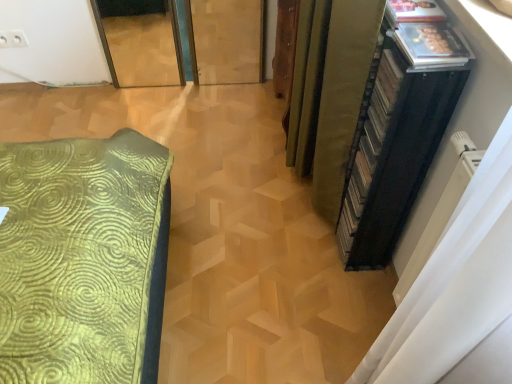
Image resolution: width=512 pixels, height=384 pixels. Describe the element at coordinates (399, 132) in the screenshot. I see `black plastic file cabinet at right` at that location.

In order to click on black plastic file cabinet at right in this screenshot , I will do `click(399, 132)`.

Describe the element at coordinates (13, 39) in the screenshot. This screenshot has width=512, height=384. I see `white plastic electric outlet at upper left` at that location.

The image size is (512, 384). Find the location of `black plastic file cabinet at right`. black plastic file cabinet at right is located at coordinates (399, 132).

In the scene shown: Considering the relative sizes of white plastic electric outlet at upper left and black plastic file cabinet at right in the image provided, is white plastic electric outlet at upper left thinner than black plastic file cabinet at right?

Yes.

Looking at this image, does white plastic electric outlet at upper left turn towards black plastic file cabinet at right?

No, white plastic electric outlet at upper left is not oriented towards black plastic file cabinet at right.

From the image's perspective, is white plastic electric outlet at upper left positioned above or below black plastic file cabinet at right?

Based on their image positions, white plastic electric outlet at upper left is located above black plastic file cabinet at right.

Identify the location of electric outlet lying behind the black plastic file cabinet at right. (13, 39).

Who is bigger, white plastic electric outlet at upper left or green fabric curtain at right?

green fabric curtain at right.

What's the angular difference between white plastic electric outlet at upper left and green fabric curtain at right's facing directions?

The facing directions of white plastic electric outlet at upper left and green fabric curtain at right are 93.2 degrees apart.

Which is more to the right, white plastic electric outlet at upper left or green fabric curtain at right?

green fabric curtain at right is more to the right.

Which of these two, white plastic electric outlet at upper left or green fabric curtain at right, stands taller?

Standing taller between the two is green fabric curtain at right.

Relative to white plastic electric outlet at upper left, is black plastic file cabinet at right in front or behind?

In the image, black plastic file cabinet at right appears in front of white plastic electric outlet at upper left.

Is black plastic file cabinet at right taller or shorter than white plastic electric outlet at upper left?

black plastic file cabinet at right is taller than white plastic electric outlet at upper left.

Is black plastic file cabinet at right not inside white plastic electric outlet at upper left?

black plastic file cabinet at right lies outside white plastic electric outlet at upper left's area.

Is black plastic file cabinet at right aimed at white plastic electric outlet at upper left?

No, black plastic file cabinet at right is not turned towards white plastic electric outlet at upper left.

Does green fabric curtain at right appear on the left side of white plastic electric outlet at upper left?

No, green fabric curtain at right is not to the left of white plastic electric outlet at upper left.

How far apart are green fabric curtain at right and white plastic electric outlet at upper left?

green fabric curtain at right and white plastic electric outlet at upper left are 5.27 feet apart.

Who is bigger, green fabric curtain at right or white plastic electric outlet at upper left?

green fabric curtain at right.

From a real-world perspective, does green fabric curtain at right stand above white plastic electric outlet at upper left?

Yes, from a real-world perspective, green fabric curtain at right is over white plastic electric outlet at upper left

Would you say green fabric curtain at right is to the left or to the right of black plastic file cabinet at right in the picture?

Clearly, green fabric curtain at right is on the left of black plastic file cabinet at right in the image.

From the image's perspective, who appears lower, green fabric curtain at right or black plastic file cabinet at right?

black plastic file cabinet at right.

Does green fabric curtain at right have a smaller size compared to black plastic file cabinet at right?

Actually, green fabric curtain at right might be larger than black plastic file cabinet at right.

From their relative heights in the image, would you say green fabric curtain at right is taller or shorter than black plastic file cabinet at right?

green fabric curtain at right is taller than black plastic file cabinet at right.

Is black plastic file cabinet at right positioned behind green fabric curtain at right?

That is False.

Is black plastic file cabinet at right facing away from green fabric curtain at right?

black plastic file cabinet at right is not turned away from green fabric curtain at right.

Considering the relative sizes of black plastic file cabinet at right and green fabric curtain at right in the image provided, is black plastic file cabinet at right wider than green fabric curtain at right?

Incorrect, the width of black plastic file cabinet at right does not surpass that of green fabric curtain at right.

From the picture: Does black plastic file cabinet at right have a larger size compared to green fabric curtain at right?

No.

Where is `file cabinet above the white plastic electric outlet at upper left (from a real-world perspective)`? Image resolution: width=512 pixels, height=384 pixels. file cabinet above the white plastic electric outlet at upper left (from a real-world perspective) is located at coordinates (399, 132).

I want to click on electric outlet behind the green fabric curtain at right, so click(x=13, y=39).

Considering their positions, is white plastic electric outlet at upper left positioned further to green fabric curtain at right than black plastic file cabinet at right?

The object further to green fabric curtain at right is white plastic electric outlet at upper left.

From the image, which object appears to be nearer to black plastic file cabinet at right, green fabric curtain at right or white plastic electric outlet at upper left?

green fabric curtain at right.

Which object lies nearer to the anchor point white plastic electric outlet at upper left, black plastic file cabinet at right or green fabric curtain at right?

green fabric curtain at right lies closer to white plastic electric outlet at upper left than the other object.

Estimate the real-world distances between objects in this image. Which object is further from green fabric curtain at right, black plastic file cabinet at right or white plastic electric outlet at upper left?

The object further to green fabric curtain at right is white plastic electric outlet at upper left.

Based on their spatial positions, is white plastic electric outlet at upper left or green fabric curtain at right further from black plastic file cabinet at right?

white plastic electric outlet at upper left.

Consider the image. Considering their positions, is green fabric curtain at right positioned further to white plastic electric outlet at upper left than black plastic file cabinet at right?

black plastic file cabinet at right.

Locate an element on the screen. The image size is (512, 384). curtain located between white plastic electric outlet at upper left and black plastic file cabinet at right in the left-right direction is located at coordinates (329, 91).